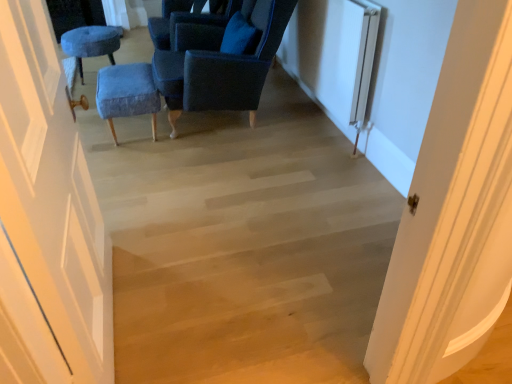
Question: Is velvet blue ottoman at center, which is the 2th furniture from back to front, outside of velvet blue chair at center, placed as the second chair when sorted from back to front?

Choices:
 (A) no
 (B) yes

Answer: (B)

Question: Does velvet blue ottoman at center, positioned as the first furniture in front-to-back order, have a larger size compared to velvet blue chair at center, arranged as the 1th chair when viewed from the front?

Choices:
 (A) yes
 (B) no

Answer: (B)

Question: Is velvet blue ottoman at center, positioned as the first furniture in front-to-back order, positioned with its back to velvet blue chair at center, arranged as the 1th chair when viewed from the front?

Choices:
 (A) no
 (B) yes

Answer: (B)

Question: Is velvet blue ottoman at center, positioned as the first furniture in front-to-back order, behind velvet blue chair at center, arranged as the 1th chair when viewed from the front?

Choices:
 (A) yes
 (B) no

Answer: (A)

Question: Is velvet blue ottoman at center, which appears as the 1th furniture when ordered from the bottom, far from velvet blue chair at center, placed as the second chair when sorted from back to front?

Choices:
 (A) yes
 (B) no

Answer: (B)

Question: In the image, is white textured radiator at right on the left side or the right side of velvet blue chair at center, arranged as the 1th chair when viewed from the front?

Choices:
 (A) right
 (B) left

Answer: (A)

Question: Is white textured radiator at right situated inside velvet blue chair at center, placed as the second chair when sorted from back to front, or outside?

Choices:
 (A) outside
 (B) inside

Answer: (A)

Question: In the image, is white textured radiator at right positioned in front of or behind velvet blue chair at center, arranged as the 1th chair when viewed from the front?

Choices:
 (A) behind
 (B) front

Answer: (B)

Question: Considering the positions of white textured radiator at right and velvet blue chair at center, arranged as the 1th chair when viewed from the front, in the image, is white textured radiator at right bigger or smaller than velvet blue chair at center, arranged as the 1th chair when viewed from the front,?

Choices:
 (A) big
 (B) small

Answer: (B)

Question: In terms of height, does velvet blue chair at center, arranged as the 1th chair when viewed from the front, look taller or shorter compared to velvet blue chair at upper center, the second chair viewed from the front?

Choices:
 (A) short
 (B) tall

Answer: (B)

Question: Considering the relative positions of velvet blue chair at center, placed as the second chair when sorted from back to front, and velvet blue chair at upper center, the second chair viewed from the front, in the image provided, is velvet blue chair at center, placed as the second chair when sorted from back to front, to the left or to the right of velvet blue chair at upper center, the second chair viewed from the front,?

Choices:
 (A) right
 (B) left

Answer: (A)

Question: Relative to velvet blue chair at upper center, the second chair viewed from the front, is velvet blue chair at center, arranged as the 1th chair when viewed from the front, in front or behind?

Choices:
 (A) front
 (B) behind

Answer: (A)

Question: Is point (163, 54) closer or farther from the camera than point (168, 16)?

Choices:
 (A) closer
 (B) farther

Answer: (A)

Question: Is velvet blue ottoman at center, placed as the 2th furniture when sorted from left to right, inside the boundaries of velvet blue ottoman at upper left, the second furniture in the bottom-to-top sequence, or outside?

Choices:
 (A) inside
 (B) outside

Answer: (B)

Question: Would you say velvet blue ottoman at center, positioned as the first furniture in front-to-back order, is to the left or to the right of velvet blue ottoman at upper left, which is counted as the 2th furniture, starting from the front, in the picture?

Choices:
 (A) left
 (B) right

Answer: (B)